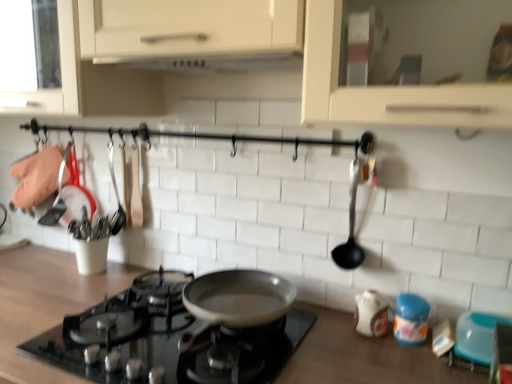
Question: Considering the positions of black plastic spoon at right and white matte exhaust hood at upper center in the image, is black plastic spoon at right taller or shorter than white matte exhaust hood at upper center?

Choices:
 (A) short
 (B) tall

Answer: (B)

Question: Considering the positions of point (350, 210) and point (224, 64), is point (350, 210) closer or farther from the camera than point (224, 64)?

Choices:
 (A) closer
 (B) farther

Answer: (A)

Question: Which object is positioned closest to the blue plastic container at lower right, placed as the first appliance when sorted from left to right?

Choices:
 (A) black glass gas stove at center
 (B) black plastic spoon at right
 (C) blue plastic bowl at lower right, the second appliance from the left
 (D) wooden countertop at center
 (E) white matte exhaust hood at upper center

Answer: (C)

Question: Which object is the closest to the black glass gas stove at center?

Choices:
 (A) white matte exhaust hood at upper center
 (B) blue plastic container at lower right, marked as the second appliance in a right-to-left arrangement
 (C) wooden countertop at center
 (D) black plastic spoon at right
 (E) blue plastic bowl at lower right, the second appliance from the left

Answer: (C)